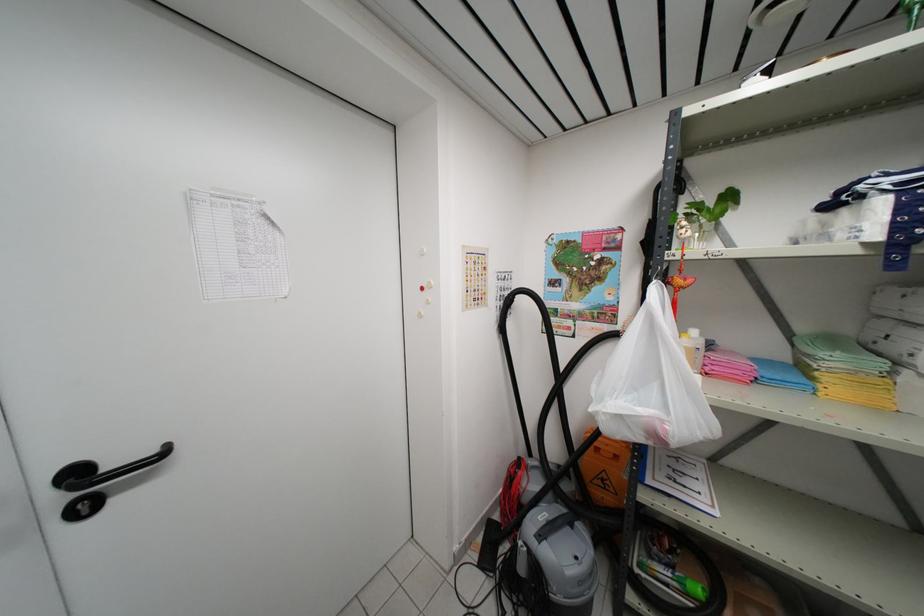
Find the location of a particular element. This screenshot has width=924, height=616. black vacuum handle is located at coordinates 554,525.